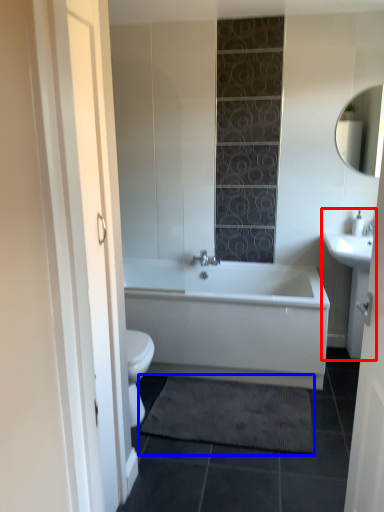
Question: Among these objects, which one is farthest to the camera, sink (highlighted by a red box) or bath mat (highlighted by a blue box)?

Choices:
 (A) sink
 (B) bath mat

Answer: (A)